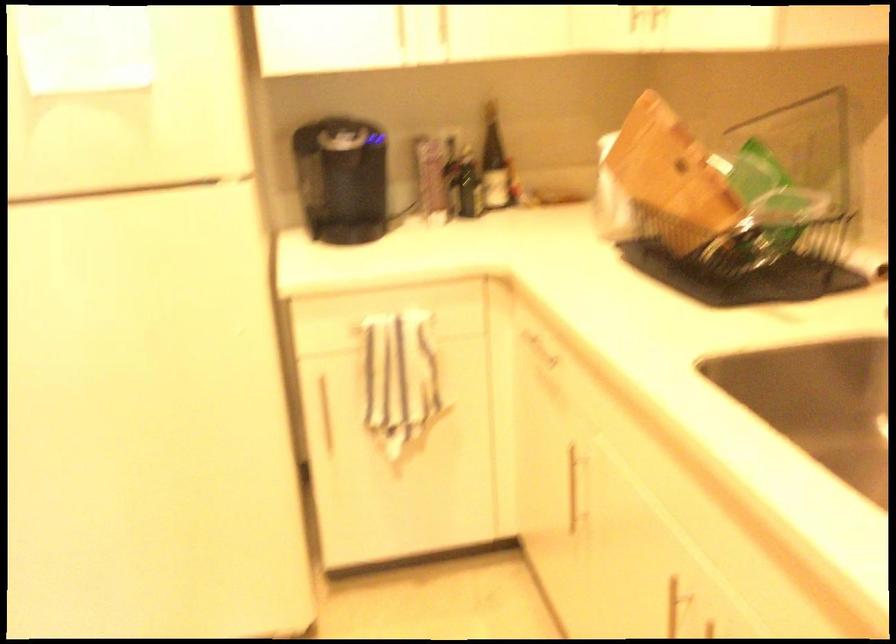
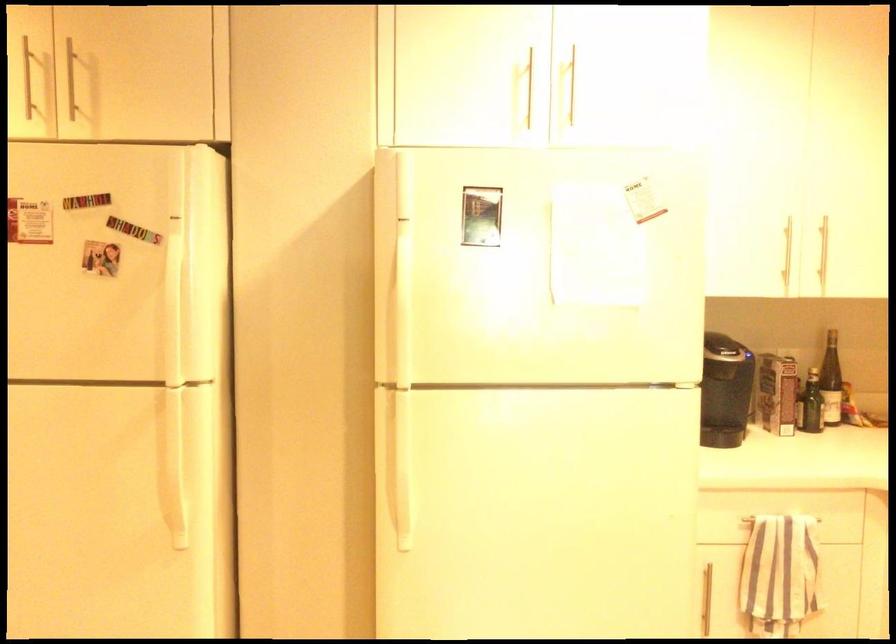
In the second image, find the point that corresponds to point 423,182 in the first image.

(777, 393)